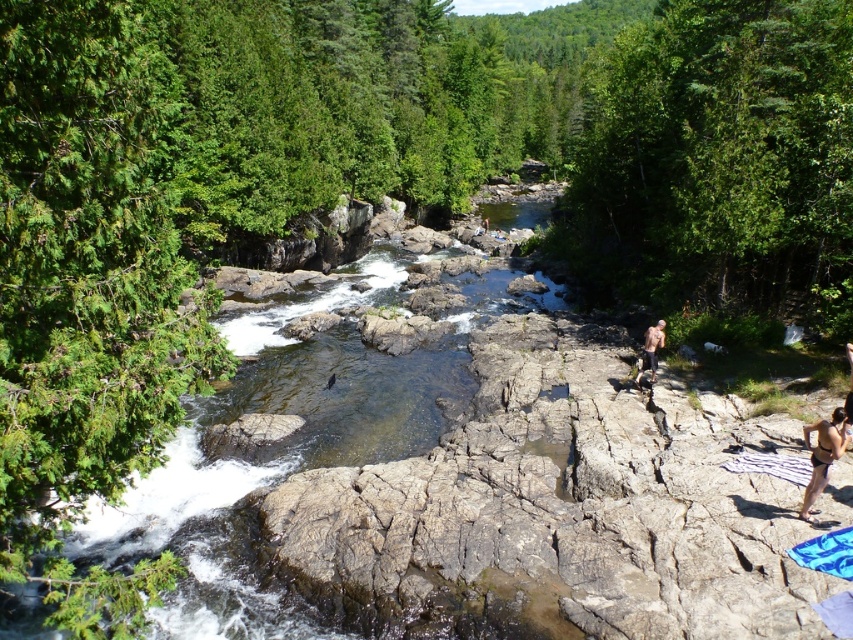
Does clear water at center appear on the right side of white striped beach towel at lower right?

No, clear water at center is not to the right of white striped beach towel at lower right.

Can you confirm if clear water at center is taller than white striped beach towel at lower right?

Indeed, clear water at center has a greater height compared to white striped beach towel at lower right.

Locate an element on the screen. The image size is (853, 640). clear water at center is located at coordinates (283, 444).

The image size is (853, 640). I want to click on clear water at center, so click(x=283, y=444).

Identify the location of white striped beach towel at lower right. This screenshot has width=853, height=640. (772, 465).

Who is higher up, white striped beach towel at lower right or skinny man at center?

skinny man at center is above.

Is point (791, 458) farther from viewer compared to point (653, 362)?

No, it is in front of (653, 362).

Identify the location of white striped beach towel at lower right. Image resolution: width=853 pixels, height=640 pixels. (772, 465).

Is clear water at center in front of brown skin at lower right?

Yes, it is.

Which is below, clear water at center or brown skin at lower right?

brown skin at lower right

Identify the location of clear water at center. (283, 444).